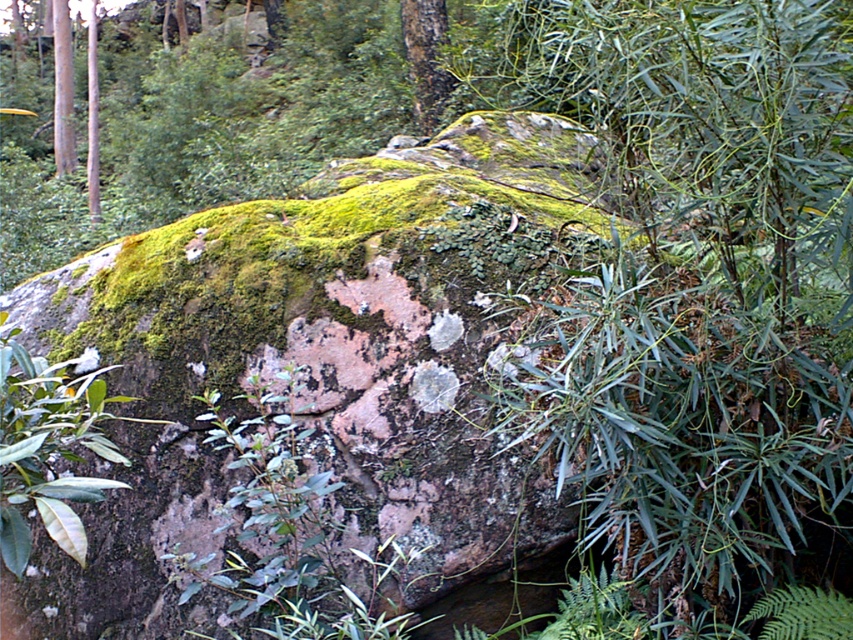
Question: Is smooth bark tree at upper center positioned before smooth brown tree trunk at left?

Choices:
 (A) no
 (B) yes

Answer: (B)

Question: Which object appears closest to the camera in this image?

Choices:
 (A) smooth bark tree at upper center
 (B) smooth brown pole at upper left

Answer: (A)

Question: Which point is closer to the camera taking this photo?

Choices:
 (A) (413, 54)
 (B) (62, 12)

Answer: (A)

Question: Which object appears closest to the camera in this image?

Choices:
 (A) smooth bark tree at upper center
 (B) smooth brown pole at upper left

Answer: (A)

Question: Does smooth brown tree trunk at left come in front of smooth brown pole at upper left?

Choices:
 (A) yes
 (B) no

Answer: (B)

Question: Is smooth bark tree at upper center positioned before smooth brown pole at upper left?

Choices:
 (A) yes
 (B) no

Answer: (A)